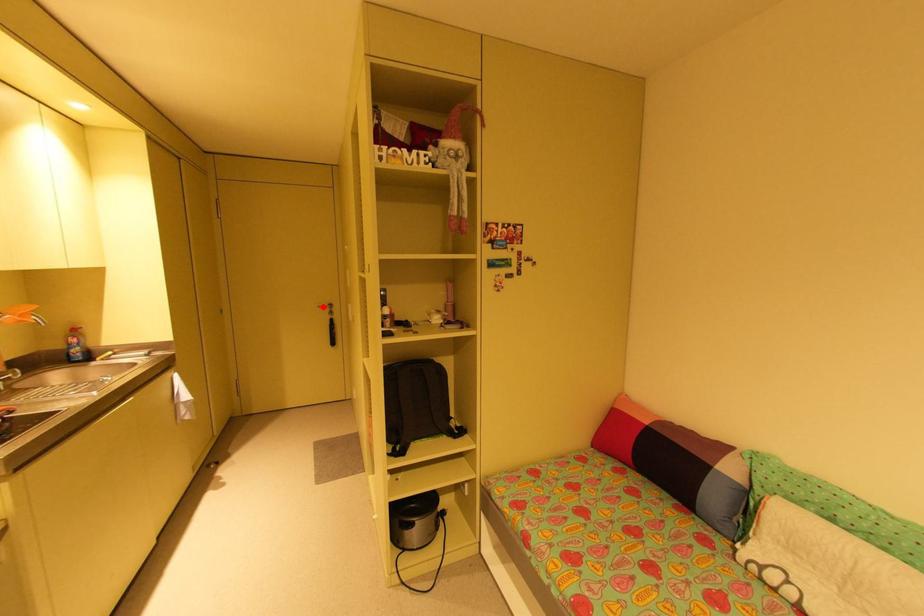
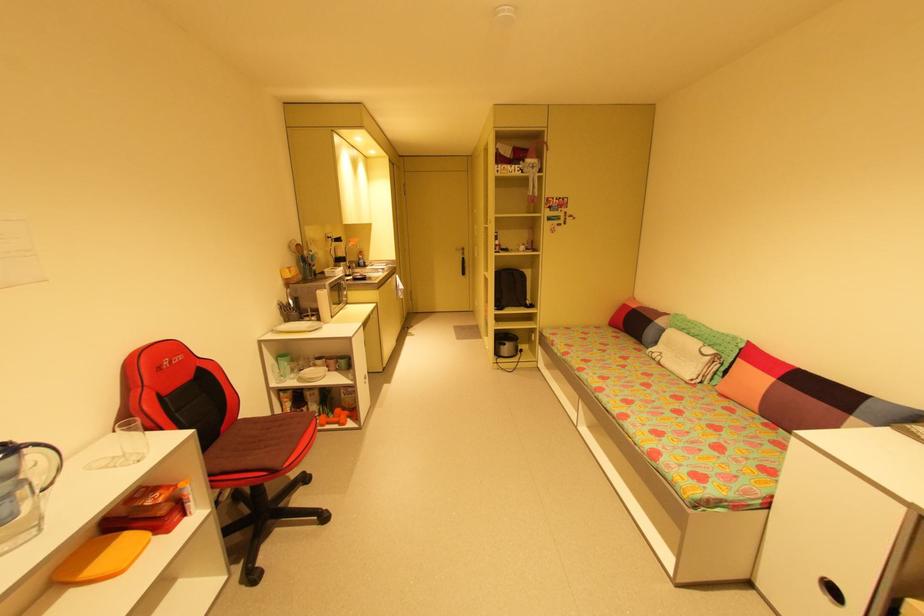
In the second image, find the point that corresponds to the highlighted location in the first image.

(460, 249)